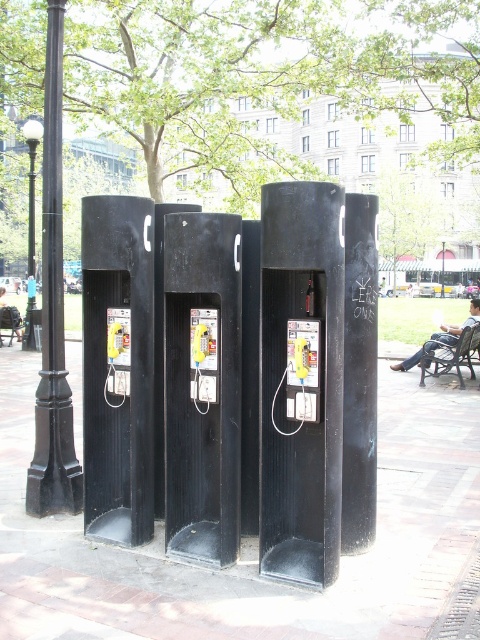
Question: Is matte black phone booth at left bigger than yellow glossy payphone at center?

Choices:
 (A) yes
 (B) no

Answer: (A)

Question: Considering the real-world distances, which object is farthest from the wooden park bench at center?

Choices:
 (A) yellow glossy payphone at center
 (B) black metal lamp post at left
 (C) matte black phone booth at center

Answer: (A)

Question: Is black matte phone booth at center positioned at the back of black metal lamp post at center?

Choices:
 (A) no
 (B) yes

Answer: (A)

Question: Can you confirm if black polished metal pole at left is positioned to the right of wooden park bench at lower right?

Choices:
 (A) no
 (B) yes

Answer: (A)

Question: Estimate the real-world distances between objects in this image. Which object is closer to the wooden park bench at lower right?

Choices:
 (A) black metal lamp post at left
 (B) black matte phone booth at center

Answer: (B)

Question: Which point is closer to the camera?

Choices:
 (A) matte black payphone at center
 (B) black metal lamp post at center
 (C) black polished metal pole at left

Answer: (A)